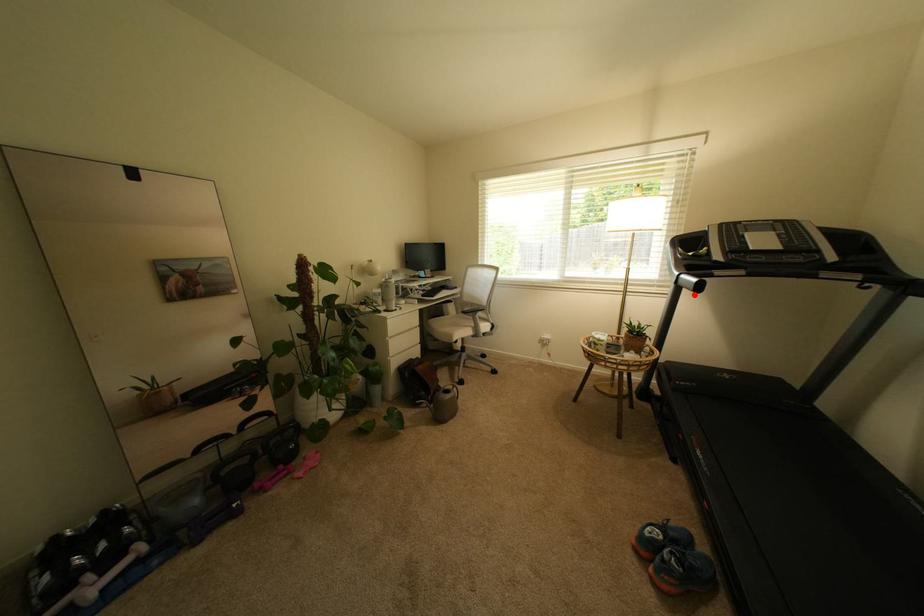
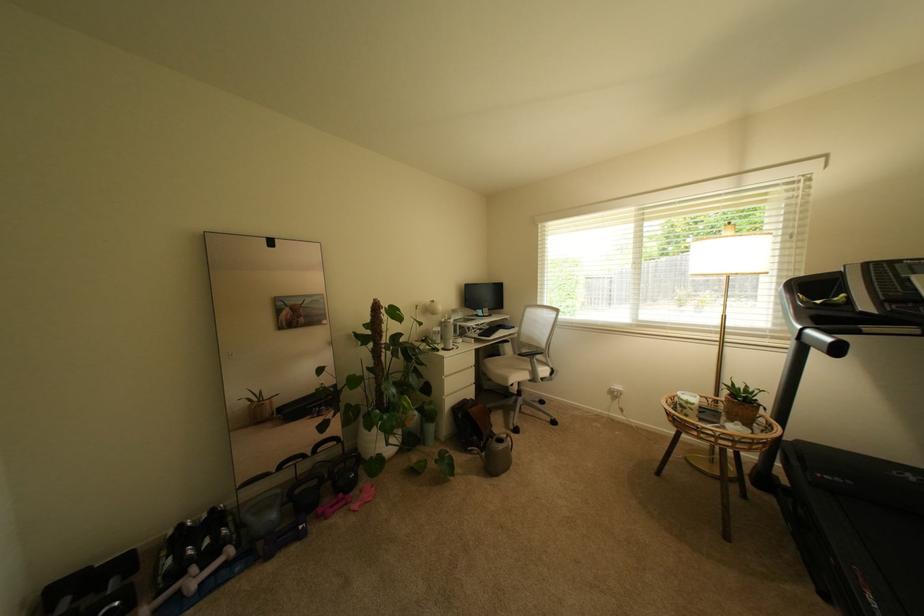
In the second image, find the point that corresponds to the highlighted location in the first image.

(824, 355)